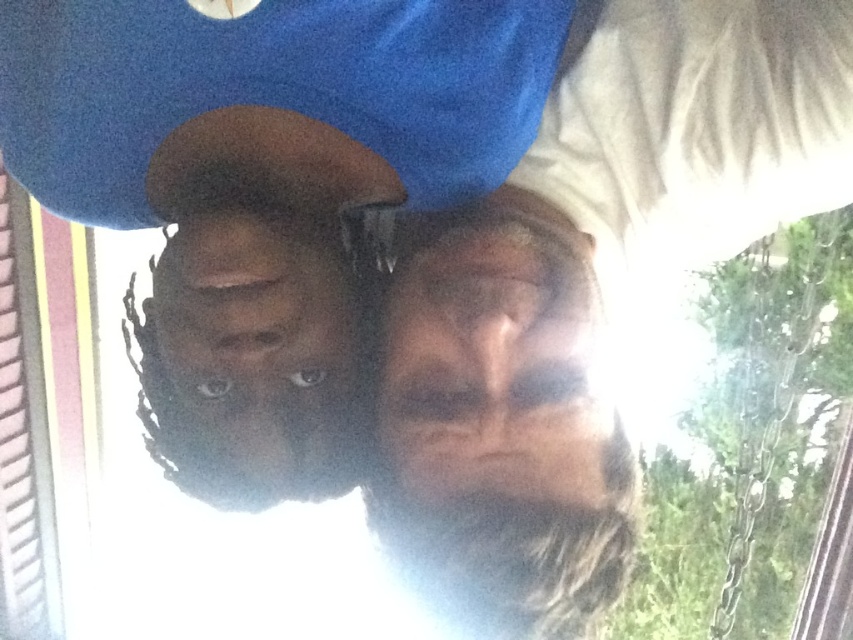
Question: From the image, what is the correct spatial relationship of matte blue shirt at upper center in relation to blue matte cap at upper center?

Choices:
 (A) left
 (B) right

Answer: (B)

Question: Can you confirm if matte blue shirt at upper center is positioned to the left of blue matte cap at upper center?

Choices:
 (A) no
 (B) yes

Answer: (A)

Question: Which of the following is the farthest from the observer?

Choices:
 (A) (561, 534)
 (B) (309, 131)

Answer: (B)

Question: Can you confirm if matte blue shirt at upper center is smaller than blue matte cap at upper center?

Choices:
 (A) no
 (B) yes

Answer: (B)